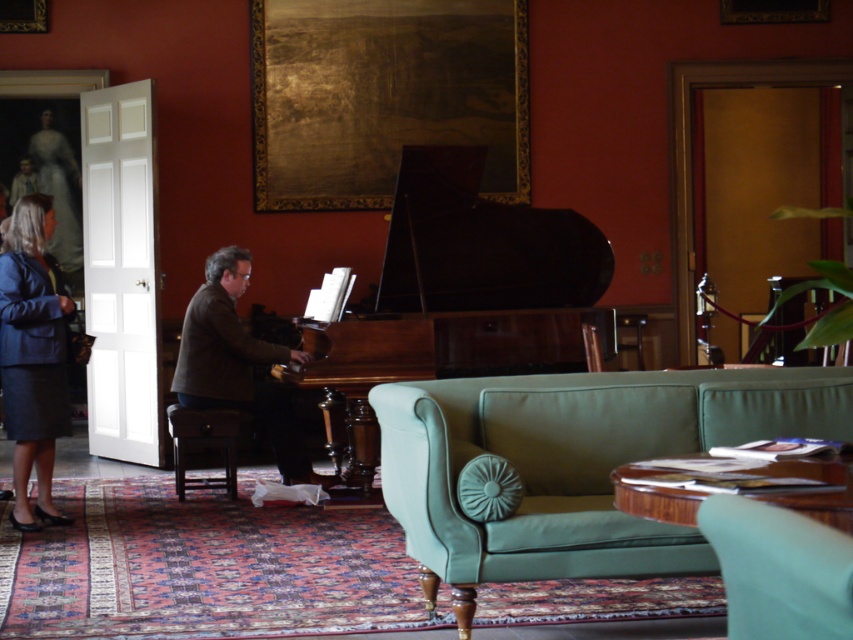
Is light green leather couch at center bigger than wooden piano at center?

Yes.

Does light green leather couch at center have a lesser width compared to wooden piano at center?

In fact, light green leather couch at center might be wider than wooden piano at center.

Is point (650, 520) closer to viewer compared to point (296, 364)?

Yes, it is in front of point (296, 364).

You are a GUI agent. You are given a task and a screenshot of the screen. Output one action in this format:
    pyautogui.click(x=<x>, y=<y>)
    Task: Click on the light green leather couch at center
    This screenshot has width=853, height=640.
    Given the screenshot: What is the action you would take?
    pyautogui.click(x=573, y=465)

Is shiny polished wood piano at center above wooden piano at center?

Indeed, shiny polished wood piano at center is positioned over wooden piano at center.

Does shiny polished wood piano at center lie in front of wooden piano at center?

That is True.

Is point (428, 348) behind point (305, 337)?

No, it is in front of (305, 337).

Identify the location of shiny polished wood piano at center. (463, 291).

Is light green leather couch at center shorter than shiny polished wood piano at center?

Yes.

Consider the image. Does light green leather couch at center lie behind shiny polished wood piano at center?

No.

What are the coordinates of `light green leather couch at center` in the screenshot? It's located at (573, 465).

Find the location of a particular element. light green leather couch at center is located at coordinates pos(573,465).